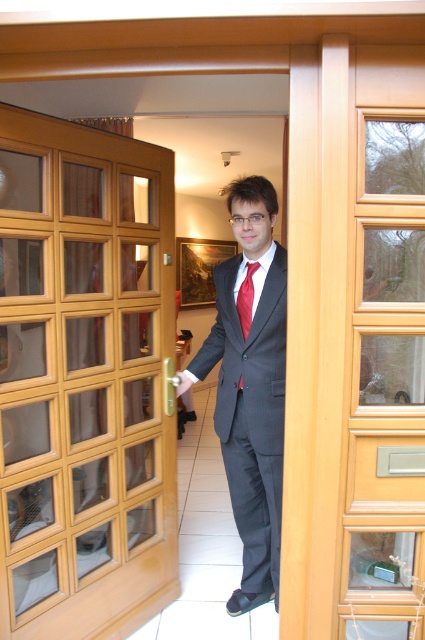
Is point (19, 118) closer to camera compared to point (246, 310)?

That is True.

Is wooden glass at left to the right of red satin tie at center from the viewer's perspective?

In fact, wooden glass at left is to the left of red satin tie at center.

Between point (113, 248) and point (249, 317), which one is positioned in front?

Point (249, 317)

Locate an element on the screen. wooden glass at left is located at coordinates (85, 380).

Can you confirm if wooden glass at left is bigger than dark gray suit at center?

Indeed, wooden glass at left has a larger size compared to dark gray suit at center.

Between point (67, 522) and point (220, 308), which one is positioned behind?

Point (220, 308)

Where is `wooden glass at left`? This screenshot has height=640, width=425. wooden glass at left is located at coordinates (85, 380).

Describe the element at coordinates (249, 385) in the screenshot. I see `dark gray suit at center` at that location.

Is dark gray suit at center smaller than red satin tie at center?

Actually, dark gray suit at center might be larger than red satin tie at center.

Identify the location of dark gray suit at center. (249, 385).

Locate an element on the screen. dark gray suit at center is located at coordinates (249, 385).